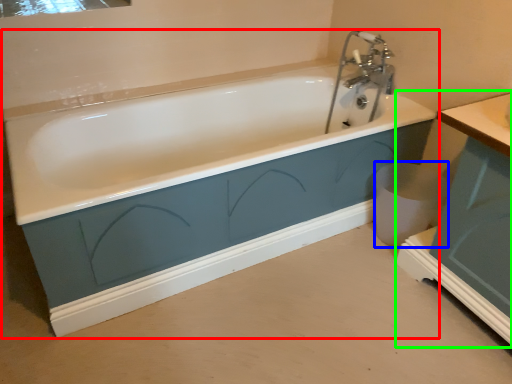
Question: Which object is positioned closest to bathtub (highlighted by a red box)? Select from toilet bowl (highlighted by a blue box) and vanity (highlighted by a green box).

Choices:
 (A) toilet bowl
 (B) vanity

Answer: (A)